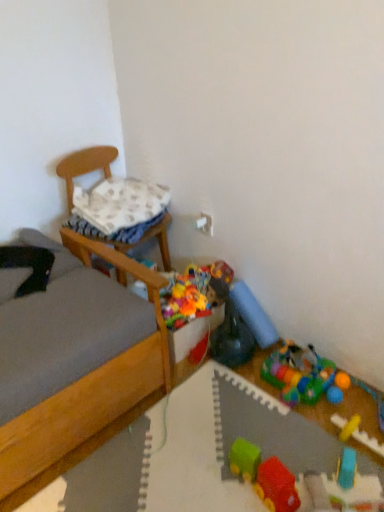
Where is `vacant position to the left of blue rubber toy at lower right, which is the 3th toy from front to back`? The width and height of the screenshot is (384, 512). vacant position to the left of blue rubber toy at lower right, which is the 3th toy from front to back is located at coordinates (306, 470).